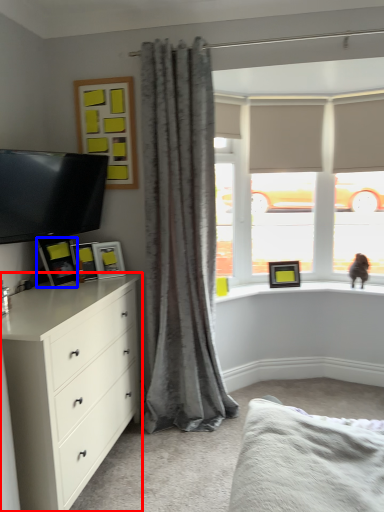
Question: Among these objects, which one is nearest to the camera, chest of drawers (highlighted by a red box) or picture frame (highlighted by a blue box)?

Choices:
 (A) chest of drawers
 (B) picture frame

Answer: (A)